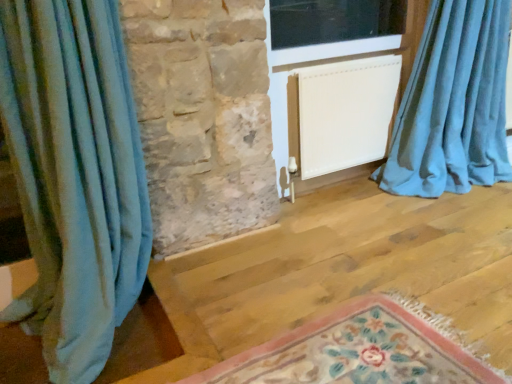
What do you see at coordinates (327, 48) in the screenshot?
I see `transparent glass window at upper center` at bounding box center [327, 48].

What do you see at coordinates (360, 350) in the screenshot? This screenshot has width=512, height=384. I see `floral rug at lower center` at bounding box center [360, 350].

Image resolution: width=512 pixels, height=384 pixels. What do you see at coordinates (346, 113) in the screenshot?
I see `white matte radiator at center` at bounding box center [346, 113].

This screenshot has height=384, width=512. What do you see at coordinates (453, 104) in the screenshot? I see `blue velvet curtain at right, which appears as the 2th curtain when viewed from the left` at bounding box center [453, 104].

In the scene shown: How much space does blue fabric curtain at left, which is counted as the second curtain, starting from the right, occupy vertically?

blue fabric curtain at left, which is counted as the second curtain, starting from the right, is 4.06 feet tall.

What is the approximate width of white matte screen door at center?

The width of white matte screen door at center is 5.04 inches.

Locate an element on the screen. The width and height of the screenshot is (512, 384). transparent glass window at upper center is located at coordinates (327, 48).

Between transparent glass window at upper center and white matte radiator at center, which one appears on the right side from the viewer's perspective?

white matte radiator at center is more to the right.

Is white matte radiator at center a part of transparent glass window at upper center?

Definitely not — white matte radiator at center is not inside transparent glass window at upper center.

From the image's perspective, between transparent glass window at upper center and white matte radiator at center, which one is located above?

transparent glass window at upper center is shown above in the image.

Which object is more forward, transparent glass window at upper center or white matte radiator at center?

transparent glass window at upper center.

Would you say white matte screen door at center is to the left or to the right of white matte radiator at center in the picture?

Based on their positions, white matte screen door at center is located to the right of white matte radiator at center.

Is white matte screen door at center in front of or behind white matte radiator at center in the image?

In the image, white matte screen door at center appears in front of white matte radiator at center.

Is white matte screen door at center taller than white matte radiator at center?

Indeed, white matte screen door at center has a greater height compared to white matte radiator at center.

Is blue fabric curtain at left, which is counted as the second curtain, starting from the right, far away from transparent glass window at upper center?

blue fabric curtain at left, which is counted as the second curtain, starting from the right, is positioned a significant distance from transparent glass window at upper center.

Is blue fabric curtain at left, which ranks as the 1th curtain in left-to-right order, facing away from transparent glass window at upper center?

blue fabric curtain at left, which ranks as the 1th curtain in left-to-right order, is not turned away from transparent glass window at upper center.

Between blue fabric curtain at left, which ranks as the 1th curtain in left-to-right order, and transparent glass window at upper center, which one has less height?

With less height is transparent glass window at upper center.

Is blue fabric curtain at left, which is counted as the second curtain, starting from the right, thinner than transparent glass window at upper center?

Correct, the width of blue fabric curtain at left, which is counted as the second curtain, starting from the right, is less than that of transparent glass window at upper center.

Locate an element on the screen. This screenshot has width=512, height=384. window above the floral rug at lower center (from the image's perspective) is located at coordinates (327, 48).

Between floral rug at lower center and transparent glass window at upper center, which one appears on the left side from the viewer's perspective?

floral rug at lower center is more to the left.

Does point (256, 360) lie behind point (380, 40)?

No, it is not.

Who is smaller, white matte screen door at center or blue fabric curtain at left, which is counted as the second curtain, starting from the right?

With smaller size is blue fabric curtain at left, which is counted as the second curtain, starting from the right.

Considering the positions of point (278, 141) and point (7, 124), is point (278, 141) closer or farther from the camera than point (7, 124)?

Point (278, 141) is farther from the camera than point (7, 124).

Which object is closer to the camera taking this photo, white matte screen door at center or blue fabric curtain at left, which ranks as the 1th curtain in left-to-right order?

blue fabric curtain at left, which ranks as the 1th curtain in left-to-right order, is closer to the camera.

From the image's perspective, is white matte screen door at center on blue fabric curtain at left, which is counted as the second curtain, starting from the right?

Yes, from the image's perspective, white matte screen door at center is on top of blue fabric curtain at left, which is counted as the second curtain, starting from the right.

Who is more distant, floral rug at lower center or white matte radiator at center?

Positioned behind is white matte radiator at center.

Is floral rug at lower center positioned far away from white matte radiator at center?

floral rug at lower center is far away from white matte radiator at center.

Is floral rug at lower center wider than white matte radiator at center?

Yes.

From their relative heights in the image, would you say floral rug at lower center is taller or shorter than white matte radiator at center?

In the image, floral rug at lower center appears to be shorter than white matte radiator at center.

Locate an element on the screen. This screenshot has height=384, width=512. curtain that is the 2nd object located above the floral rug at lower center (from the image's perspective) is located at coordinates (453, 104).

Which object is thinner, blue velvet curtain at right, which ranks as the 1th curtain in right-to-left order, or floral rug at lower center?

blue velvet curtain at right, which ranks as the 1th curtain in right-to-left order.

Considering the positions of point (436, 57) and point (423, 356), is point (436, 57) closer or farther from the camera than point (423, 356)?

Point (436, 57) is positioned farther from the camera compared to point (423, 356).

Does blue velvet curtain at right, which ranks as the 1th curtain in right-to-left order, appear on the left side of floral rug at lower center?

No.

Where is `radiator to the right of transparent glass window at upper center`? radiator to the right of transparent glass window at upper center is located at coordinates (346, 113).

In the image, there is a white matte screen door at center. Identify the location of radiator below it (from the image's perspective). (346, 113).

Estimate the real-world distances between objects in this image. Which object is closer to floral rug at lower center, transparent glass window at upper center or blue velvet curtain at right, which appears as the 2th curtain when viewed from the left?

blue velvet curtain at right, which appears as the 2th curtain when viewed from the left, is positioned closer to the anchor floral rug at lower center.

Which object lies nearer to the anchor point blue velvet curtain at right, which appears as the 2th curtain when viewed from the left, transparent glass window at upper center or blue fabric curtain at left, which ranks as the 1th curtain in left-to-right order?

The object closer to blue velvet curtain at right, which appears as the 2th curtain when viewed from the left, is transparent glass window at upper center.

From the image, which object appears to be nearer to transparent glass window at upper center, blue fabric curtain at left, which ranks as the 1th curtain in left-to-right order, or white matte radiator at center?

white matte radiator at center lies closer to transparent glass window at upper center than the other object.

Looking at the image, which one is located further to floral rug at lower center, white matte screen door at center or white matte radiator at center?

white matte radiator at center.

Based on their spatial positions, is white matte radiator at center or floral rug at lower center closer to blue velvet curtain at right, which ranks as the 1th curtain in right-to-left order?

The object closer to blue velvet curtain at right, which ranks as the 1th curtain in right-to-left order, is white matte radiator at center.

Estimate the real-world distances between objects in this image. Which object is further from blue fabric curtain at left, which is counted as the second curtain, starting from the right, blue velvet curtain at right, which ranks as the 1th curtain in right-to-left order, or floral rug at lower center?

Based on the image, blue velvet curtain at right, which ranks as the 1th curtain in right-to-left order, appears to be further to blue fabric curtain at left, which is counted as the second curtain, starting from the right.

Estimate the real-world distances between objects in this image. Which object is further from white matte screen door at center, blue fabric curtain at left, which ranks as the 1th curtain in left-to-right order, or white matte radiator at center?

The object further to white matte screen door at center is blue fabric curtain at left, which ranks as the 1th curtain in left-to-right order.

In the scene shown: From the image, which object appears to be nearer to floral rug at lower center, blue velvet curtain at right, which ranks as the 1th curtain in right-to-left order, or white matte screen door at center?

white matte screen door at center is closer to floral rug at lower center.

Find the location of `window between blue fabric curtain at left, which is counted as the second curtain, starting from the right, and white matte radiator at center from left to right`. window between blue fabric curtain at left, which is counted as the second curtain, starting from the right, and white matte radiator at center from left to right is located at coordinates coord(327,48).

The width and height of the screenshot is (512, 384). What are the coordinates of `mat between blue fabric curtain at left, which ranks as the 1th curtain in left-to-right order, and white matte radiator at center` in the screenshot? It's located at (360, 350).

This screenshot has height=384, width=512. In order to click on radiator located between transparent glass window at upper center and blue velvet curtain at right, which ranks as the 1th curtain in right-to-left order, in the left-right direction in this screenshot , I will do point(346,113).

This screenshot has height=384, width=512. Identify the location of screen door between white matte radiator at center and blue velvet curtain at right, which ranks as the 1th curtain in right-to-left order, from left to right. (302, 69).